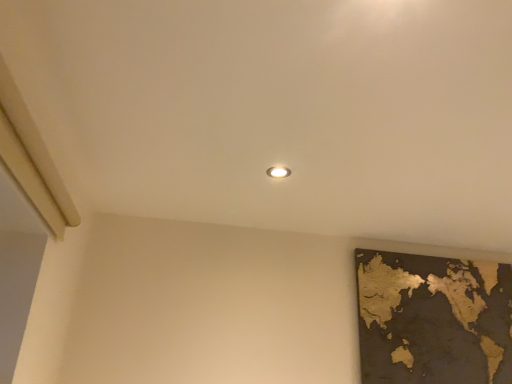
The height and width of the screenshot is (384, 512). I want to click on gold metallic map at lower right, so click(x=433, y=319).

Describe the element at coordinates (433, 319) in the screenshot. I see `gold metallic map at lower right` at that location.

The image size is (512, 384). In order to click on gold metallic map at lower right in this screenshot , I will do `click(433, 319)`.